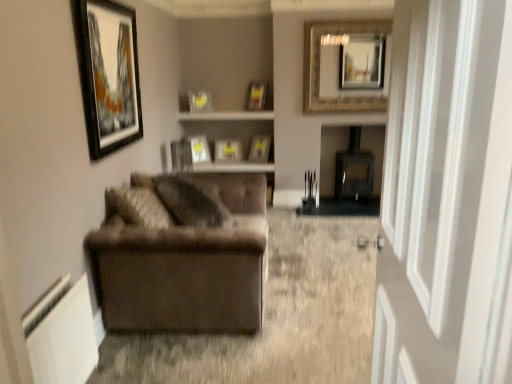
Question: Visually, is matte glass picture frame at upper center, arranged as the 4th picture frame when viewed from the left, positioned to the left or to the right of velvet brown couch at left?

Choices:
 (A) left
 (B) right

Answer: (A)

Question: Considering the positions of matte glass picture frame at upper center, arranged as the 4th picture frame when viewed from the left, and velvet brown couch at left in the image, is matte glass picture frame at upper center, arranged as the 4th picture frame when viewed from the left, wider or thinner than velvet brown couch at left?

Choices:
 (A) thin
 (B) wide

Answer: (A)

Question: Based on their relative distances, which object is farther from the brown fabric armchair at left?

Choices:
 (A) gold-framed mirror at upper center, acting as the sixth picture frame starting from the back
 (B) metallic silver picture frame at center, the seventh picture frame in the back-to-front sequence
 (C) wooden shelf at center
 (D) matte black wood table at center
 (E) matte glass picture frame at upper center, the 4th picture frame positioned from the front

Answer: (E)

Question: Which is nearer to the brown fabric armchair at left?

Choices:
 (A) velvet brown couch at left
 (B) wooden shelf at center
 (C) matte silver picture frame at center, the 8th picture frame in the front-to-back sequence
 (D) transparent glass door at right
 (E) matte glass picture frame at upper center, the 5th picture frame from the back

Answer: (A)